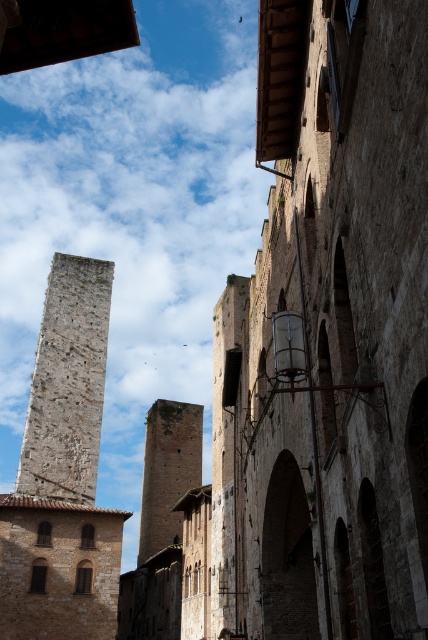
Question: Which point is farther from the camera taking this photo?

Choices:
 (A) (42, 317)
 (B) (154, 432)

Answer: (B)

Question: Does rough stone tower at left appear on the left side of brown stone tower at center?

Choices:
 (A) no
 (B) yes

Answer: (B)

Question: Which object appears closest to the camera in this image?

Choices:
 (A) rough stone tower at left
 (B) brown stone tower at center

Answer: (A)

Question: Is rough stone tower at left bigger than brown stone tower at center?

Choices:
 (A) no
 (B) yes

Answer: (B)

Question: Among these points, which one is nearest to the camera?

Choices:
 (A) (154, 426)
 (B) (24, 490)

Answer: (B)

Question: Observing the image, what is the correct spatial positioning of rough stone tower at left in reference to brown stone tower at center?

Choices:
 (A) above
 (B) below

Answer: (A)